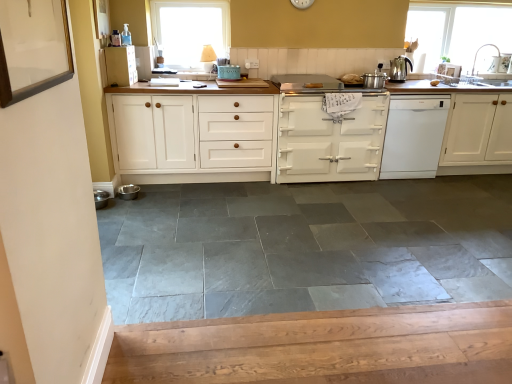
Where is `metallic silver sink at right, arranged as the 5th appliance when viewed from the left`? This screenshot has width=512, height=384. metallic silver sink at right, arranged as the 5th appliance when viewed from the left is located at coordinates (499, 63).

Measure the distance between gray slate tile at center and camera.

They are 2.10 meters apart.

The width and height of the screenshot is (512, 384). In order to click on matte green enamel stove at center, the third appliance viewed from the back in this screenshot , I will do `click(228, 72)`.

Describe the element at coordinates (329, 139) in the screenshot. I see `white matte oven at center, the second cabinetry positioned from the right` at that location.

Where is `satin silver pot at upper right, which is the fourth appliance from top to bottom`? The height and width of the screenshot is (384, 512). satin silver pot at upper right, which is the fourth appliance from top to bottom is located at coordinates (374, 80).

Consider the image. Does white wood cabinet at upper center, the 4th cabinetry when ordered from right to left, touch metallic silver sink at right, which is the 5th appliance in bottom-to-top order?

There is a gap between white wood cabinet at upper center, the 4th cabinetry when ordered from right to left, and metallic silver sink at right, which is the 5th appliance in bottom-to-top order.

From the image's perspective, count 3rd appliances upward from the white wood cabinet at upper center, the 4th cabinetry when ordered from right to left, and point to it. Please provide its 2D coordinates.

[(499, 63)]

From the image's perspective, is white wood cabinet at upper center, the 1th cabinetry from the left, beneath metallic silver sink at right, the 1th appliance from the right?

Yes.

Is white wood cabinet at upper center, the 4th cabinetry when ordered from right to left, wider or thinner than metallic silver sink at right, the 1th appliance positioned from the top?

Clearly, white wood cabinet at upper center, the 4th cabinetry when ordered from right to left, has more width compared to metallic silver sink at right, the 1th appliance positioned from the top.

Which point is more distant from viewer, (123,196) or (207,7)?

Positioned behind is point (207,7).

From the image's perspective, which appliance is the 5th one below the white glass window at upper center, the 1th window positioned from the front? Please provide its 2D coordinates.

[(128, 192)]

From the image's perspective, which object appears higher, metallic stainless steel bowl at lower left, the fifth appliance from the back, or white glass window at upper center, the 2th window positioned from the back?

white glass window at upper center, the 2th window positioned from the back, appears higher in the image.

What's the angular difference between matte green enamel stove at center, the 3th appliance positioned from the bottom, and metallic silver sink at right, arranged as the 5th appliance when viewed from the left,'s facing directions?

The facing directions of matte green enamel stove at center, the 3th appliance positioned from the bottom, and metallic silver sink at right, arranged as the 5th appliance when viewed from the left, are 0.000294 degrees apart.

Which appliance is the 2nd one when counting from the front of the metallic silver sink at right, which is the 5th appliance in bottom-to-top order? Please provide its 2D coordinates.

[(228, 72)]

Who is bigger, matte green enamel stove at center, the third appliance viewed from the back, or metallic silver sink at right, the 1th appliance from the right?

matte green enamel stove at center, the third appliance viewed from the back, is bigger.

Does matte green enamel stove at center, marked as the 2th appliance in a left-to-right arrangement, have a lesser width compared to metallic silver sink at right, the 1th appliance from the right?

No.

Based on the photo, can you confirm if white matte oven at center, the third cabinetry viewed from the left, is taller than metallic stainless steel bowl at lower left, the fifth appliance positioned from the right?

Yes, white matte oven at center, the third cabinetry viewed from the left, is taller than metallic stainless steel bowl at lower left, the fifth appliance positioned from the right.

Is white matte oven at center, the second cabinetry positioned from the right, turned away from metallic stainless steel bowl at lower left, which is the 1th appliance in left-to-right order?

No, metallic stainless steel bowl at lower left, which is the 1th appliance in left-to-right order, is not at the back of white matte oven at center, the second cabinetry positioned from the right.

Which is less distant, (364,145) or (136,191)?

The point (136,191) is closer to the camera.

Between white matte oven at center, the second cabinetry positioned from the right, and metallic stainless steel bowl at lower left, which appears as the first appliance when ordered from the bottom, which one has larger size?

Answer: white matte oven at center, the second cabinetry positioned from the right, is bigger.

Which point is more forward, (509, 254) or (366, 77)?

The point (509, 254) is in front.

Does gray slate tile at center have a lesser width compared to satin silver pot at upper right, which is the 2th appliance from front to back?

No, gray slate tile at center is not thinner than satin silver pot at upper right, which is the 2th appliance from front to back.

Do you think gray slate tile at center is within satin silver pot at upper right, the 3th appliance in the left-to-right sequence, or outside of it?

gray slate tile at center cannot be found inside satin silver pot at upper right, the 3th appliance in the left-to-right sequence.

In the image, is gray slate tile at center on the left side or the right side of satin silver pot at upper right, which is the fourth appliance from back to front?

gray slate tile at center is to the left of satin silver pot at upper right, which is the fourth appliance from back to front.

Is satin silver pot at upper right, the third appliance when ordered from right to left, surrounding metallic stainless steel bowl at lower left, the fifth appliance positioned from the right?

No, metallic stainless steel bowl at lower left, the fifth appliance positioned from the right, is not surrounded by satin silver pot at upper right, the third appliance when ordered from right to left.

Can you confirm if satin silver pot at upper right, which is the fourth appliance from top to bottom, is thinner than metallic stainless steel bowl at lower left, which is the 1th appliance in left-to-right order?

Incorrect, the width of satin silver pot at upper right, which is the fourth appliance from top to bottom, is not less than that of metallic stainless steel bowl at lower left, which is the 1th appliance in left-to-right order.

Which is farther from the camera, (373, 81) or (126, 197)?

The point (373, 81) is more distant.

Looking at this image, is metallic stainless steel bowl at lower left, which is counted as the fifth appliance, starting from the top, at the back of satin silver pot at upper right, the third appliance when ordered from right to left?

That's not correct — satin silver pot at upper right, the third appliance when ordered from right to left, is not looking away from metallic stainless steel bowl at lower left, which is counted as the fifth appliance, starting from the top.

Is silver metallic faucet at upper right next to white glossy dishwasher at right?

No, silver metallic faucet at upper right is not next to white glossy dishwasher at right.

Does silver metallic faucet at upper right have a greater height compared to white glossy dishwasher at right?

No.

At what (x,y) coordinates should I click in order to perform the action: click on faucet located behind the white glossy dishwasher at right. Please return your answer as a coordinate pair (x, y). The height and width of the screenshot is (384, 512). Looking at the image, I should click on (477, 54).

Locate an element on the screen. The height and width of the screenshot is (384, 512). the 1st cabinetry positioned below the metallic silver sink at right, the 1th appliance from the right (from the image's perspective) is located at coordinates (121, 65).

This screenshot has width=512, height=384. In order to click on appliance on the left of white glass window at upper center, which appears as the second window when viewed from the right in this screenshot , I will do `click(128, 192)`.

Consider the image. From the image, which object appears to be nearer to white glossy dishwasher at right, white painted wood cabinet at center, the second cabinetry viewed from the left, or white glossy microwave at upper right, placed as the fourth appliance when sorted from left to right?

white glossy microwave at upper right, placed as the fourth appliance when sorted from left to right.

From the picture: Estimate the real-world distances between objects in this image. Which object is further from metallic silver sink at right, the 1th appliance positioned from the top, white glass window at upper center, the 2th window positioned from the back, or white matte oven at center, the third cabinetry viewed from the left?

white glass window at upper center, the 2th window positioned from the back, is further to metallic silver sink at right, the 1th appliance positioned from the top.

Consider the image. Looking at the image, which one is located further to white glossy microwave at upper right, the 4th appliance when ordered from front to back, gray slate tile at center or white matte oven at center, the third cabinetry viewed from the left?

Based on the image, gray slate tile at center appears to be further to white glossy microwave at upper right, the 4th appliance when ordered from front to back.

From the image, which object appears to be nearer to satin silver pot at upper right, which is the fourth appliance from back to front, metallic silver sink at right, the 1th appliance from the right, or white wood cabinet at upper center, the 1th cabinetry from the left?

The object closer to satin silver pot at upper right, which is the fourth appliance from back to front, is metallic silver sink at right, the 1th appliance from the right.

When comparing their distances from white painted wood cabinet at center, which is counted as the third cabinetry, starting from the right, does white matte oven at center, the third cabinetry viewed from the left, or white glossy microwave at upper right, which ranks as the fourth appliance in bottom-to-top order, seem further?

The object further to white painted wood cabinet at center, which is counted as the third cabinetry, starting from the right, is white glossy microwave at upper right, which ranks as the fourth appliance in bottom-to-top order.

Based on their spatial positions, is white matte cabinet at right, the 4th cabinetry viewed from the left, or white matte oven at center, the third cabinetry viewed from the left, closer to white glossy microwave at upper right, which is the 2th appliance in top-to-bottom order?

white matte cabinet at right, the 4th cabinetry viewed from the left, lies closer to white glossy microwave at upper right, which is the 2th appliance in top-to-bottom order, than the other object.

When comparing their distances from polished stainless steel kettle at upper right, does white matte oven at center, the second cabinetry positioned from the right, or metallic silver sink at right, arranged as the 1th appliance when viewed from the back, seem closer?

Among the two, white matte oven at center, the second cabinetry positioned from the right, is located nearer to polished stainless steel kettle at upper right.

Looking at the image, which one is located closer to white matte cabinet at right, which is counted as the 1th cabinetry, starting from the right, gray slate tile at center or silver metallic faucet at upper right?

Among the two, silver metallic faucet at upper right is located nearer to white matte cabinet at right, which is counted as the 1th cabinetry, starting from the right.

The image size is (512, 384). Identify the location of home appliance located between gray slate tile at center and transparent glass window at upper right, the 1th window when ordered from right to left, in the depth direction. (414, 136).

Where is `appliance between satin silver pot at upper right, which is the fourth appliance from back to front, and transparent glass window at upper right, the first window positioned from the back, from left to right`? The height and width of the screenshot is (384, 512). appliance between satin silver pot at upper right, which is the fourth appliance from back to front, and transparent glass window at upper right, the first window positioned from the back, from left to right is located at coordinates (449, 70).

Image resolution: width=512 pixels, height=384 pixels. Find the location of `cabinetry located between white glossy microwave at upper right, positioned as the second appliance in right-to-left order, and metallic silver sink at right, arranged as the 5th appliance when viewed from the left, in the left-right direction`. cabinetry located between white glossy microwave at upper right, positioned as the second appliance in right-to-left order, and metallic silver sink at right, arranged as the 5th appliance when viewed from the left, in the left-right direction is located at coordinates (478, 130).

At what (x,y) coordinates should I click in order to perform the action: click on window located between metallic stainless steel bowl at lower left, which appears as the first appliance when ordered from the bottom, and white glossy dishwasher at right in the left-right direction. Please return your answer as a coordinate pair (x, y). Looking at the image, I should click on (190, 31).